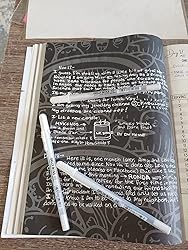
Where is `white pen diagonal on book`? white pen diagonal on book is located at coordinates (130, 205).